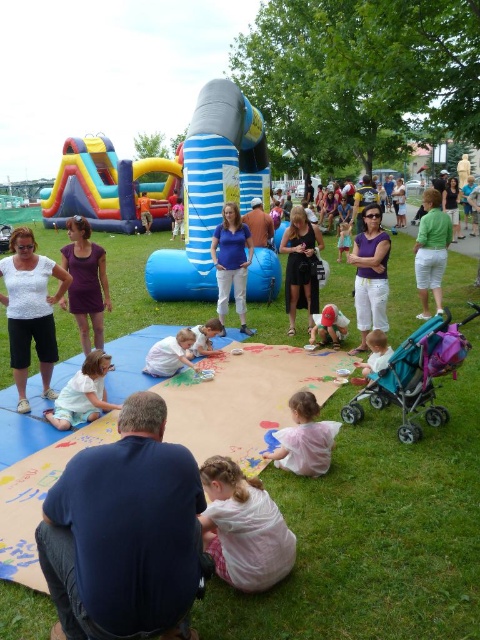
Is pink fabric at lower center bigger than light pink fabric at lower center?

Actually, pink fabric at lower center might be smaller than light pink fabric at lower center.

Between pink fabric at lower center and light pink fabric at lower center, which one has less height?

light pink fabric at lower center is shorter.

Is point (326, 442) closer to camera compared to point (157, 353)?

Yes, it is in front of point (157, 353).

This screenshot has height=640, width=480. What are the coordinates of `pink fabric at lower center` in the screenshot? It's located at (304, 438).

Is white matte shirt at center thinner than purple cotton shirt at center?

Incorrect, white matte shirt at center's width is not less than purple cotton shirt at center's.

Based on the photo, can you confirm if white matte shirt at center is positioned to the right of purple cotton shirt at center?

No, white matte shirt at center is not to the right of purple cotton shirt at center.

Does point (24, 266) lie behind point (95, 308)?

That is False.

Where is `white matte shirt at center`? This screenshot has height=640, width=480. white matte shirt at center is located at coordinates (31, 310).

Is purple cotton shirt at center positioned at the back of pink fabric dress at center?

No, it is not.

Is point (72, 259) positioned after point (343, 243)?

No, it is not.

The width and height of the screenshot is (480, 640). Describe the element at coordinates (85, 282) in the screenshot. I see `purple cotton shirt at center` at that location.

In order to click on purple cotton shirt at center in this screenshot , I will do `click(85, 282)`.